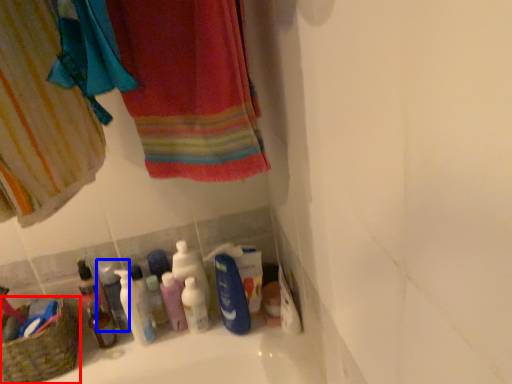
Question: Among these objects, which one is nearest to the camera, basket (highlighted by a red box) or mouthwash (highlighted by a blue box)?

Choices:
 (A) basket
 (B) mouthwash

Answer: (A)